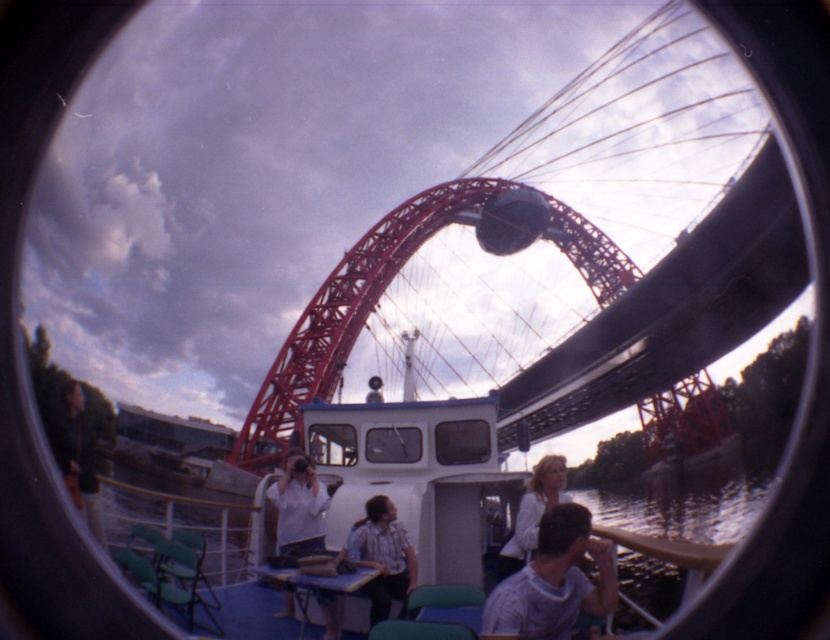
Does point (56, 417) lie behind point (536, 534)?

Yes, point (56, 417) is farther from viewer.

What do you see at coordinates (77, 456) in the screenshot? This screenshot has width=830, height=640. I see `dark brown leather jacket at lower left` at bounding box center [77, 456].

Where is `dark brown leather jacket at lower left`? This screenshot has width=830, height=640. dark brown leather jacket at lower left is located at coordinates (77, 456).

The image size is (830, 640). I want to click on dark brown leather jacket at lower left, so click(x=77, y=456).

Is light blue shirt at center closer to the viewer compared to checkered shirt at center?

Yes, light blue shirt at center is in front of checkered shirt at center.

Does light blue shirt at center lie behind checkered shirt at center?

No, it is in front of checkered shirt at center.

Identify the location of light blue shirt at center. (554, 580).

Based on the photo, does light blue shirt at center have a greater width compared to white matte shirt at center?

Yes.

Can you confirm if light blue shirt at center is positioned to the right of white matte shirt at center?

Indeed, light blue shirt at center is positioned on the right side of white matte shirt at center.

Between point (584, 582) and point (306, 536), which one is positioned in front?

Point (584, 582) is more forward.

This screenshot has width=830, height=640. Find the location of `light blue shirt at center`. light blue shirt at center is located at coordinates click(x=554, y=580).